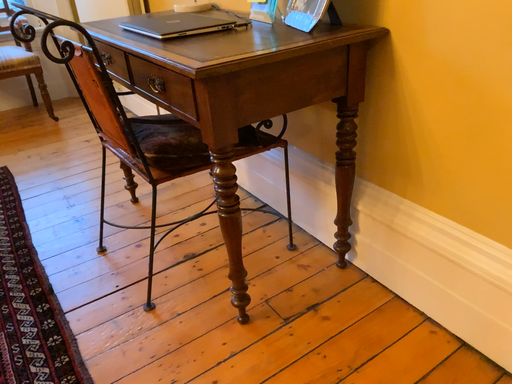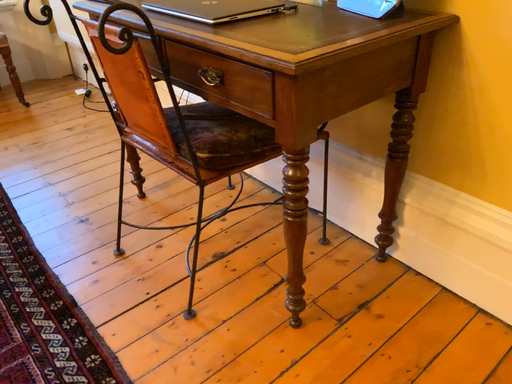
Question: How did the camera likely rotate when shooting the video?

Choices:
 (A) rotated left
 (B) rotated right

Answer: (B)